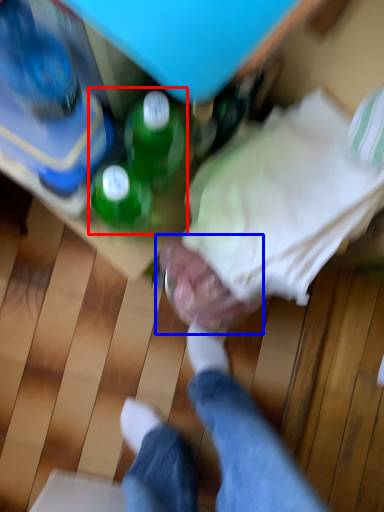
Question: Which point is closer to the camera, beverage (highlighted by a red box) or head (highlighted by a blue box)?

Choices:
 (A) beverage
 (B) head

Answer: (A)